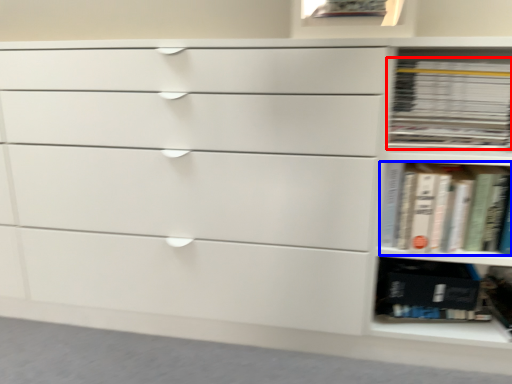
Question: Which of the following is the farthest to the observer, book (highlighted by a red box) or book (highlighted by a blue box)?

Choices:
 (A) book
 (B) book

Answer: (A)